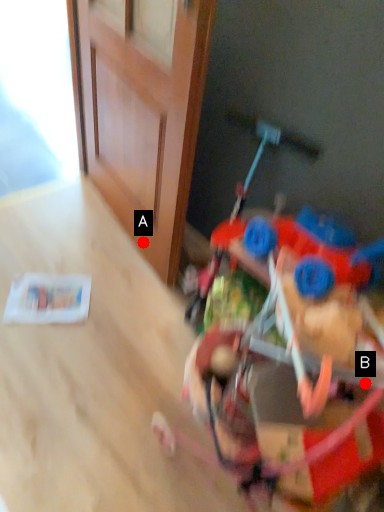
Question: Two points are circled on the image, labeled by A and B beside each circle. Which point is farther from the camera taking this photo?

Choices:
 (A) A is further
 (B) B is further

Answer: (A)